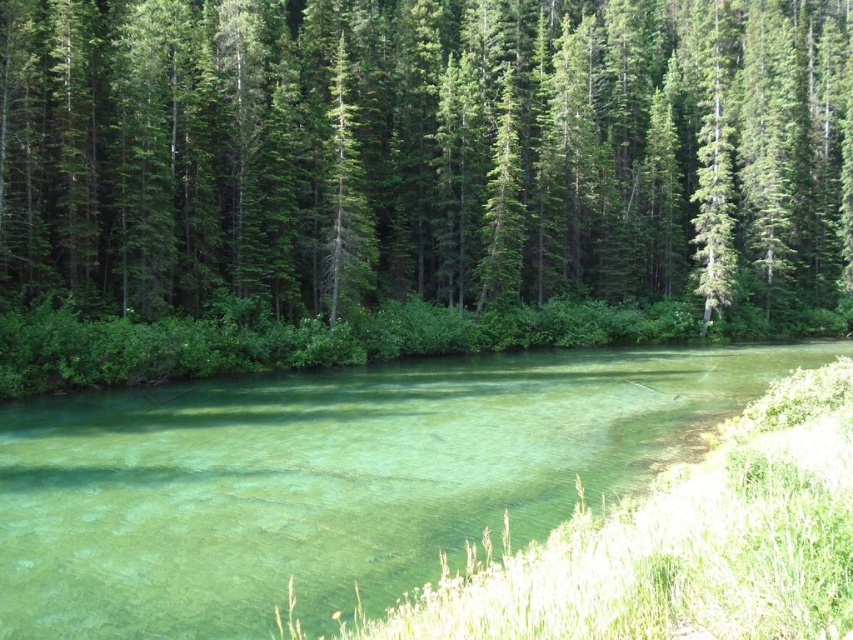
Is green textured trees at upper center closer to camera compared to clear glassy water at center?

No, green textured trees at upper center is behind clear glassy water at center.

Who is higher up, green textured trees at upper center or clear glassy water at center?

Positioned higher is green textured trees at upper center.

Describe the element at coordinates (425, 150) in the screenshot. I see `green textured trees at upper center` at that location.

Find the location of a particular element. The height and width of the screenshot is (640, 853). green textured trees at upper center is located at coordinates (425, 150).